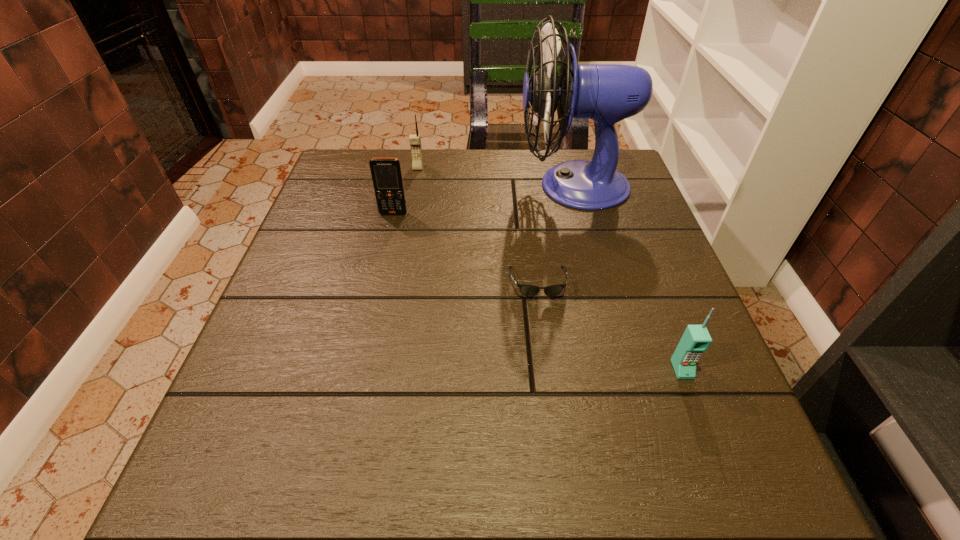
You are a GUI agent. You are given a task and a screenshot of the screen. Output one action in this format:
    pyautogui.click(x=<x>, y=<y>)
    Task: Click on the tallest object
    Image resolution: width=960 pixels, height=540 pixels.
    Given the screenshot: What is the action you would take?
    pyautogui.click(x=606, y=93)

Image resolution: width=960 pixels, height=540 pixels. Identify the location of the farthest cellular telephone. (414, 139).

The image size is (960, 540). What are the coordinates of `the second nearest cellular telephone` in the screenshot? It's located at (386, 173).

Where is `the nearest cellular telephone`? the nearest cellular telephone is located at coordinates (696, 339).

Locate an element on the screen. This screenshot has width=960, height=540. the rightmost cellular telephone is located at coordinates (696, 339).

Locate an element on the screen. The height and width of the screenshot is (540, 960). the shortest object is located at coordinates click(527, 290).

At what (x,y) coordinates should I click in order to perform the action: click on sunglasses. Please return your answer as a coordinate pair (x, y). Looking at the image, I should click on (527, 290).

Locate an element on the screen. Image resolution: width=960 pixels, height=540 pixels. free space located in front of the fan where the airflow is directed is located at coordinates (376, 186).

Locate an element on the screen. free space located in front of the fan where the airflow is directed is located at coordinates (402, 186).

This screenshot has height=540, width=960. I want to click on free spot located 0.200m in front of the fan where the airflow is directed, so click(444, 186).